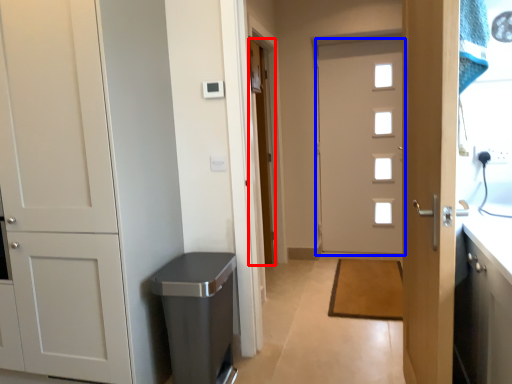
Question: Among these objects, which one is nearest to the camera, door (highlighted by a red box) or door (highlighted by a blue box)?

Choices:
 (A) door
 (B) door

Answer: (B)